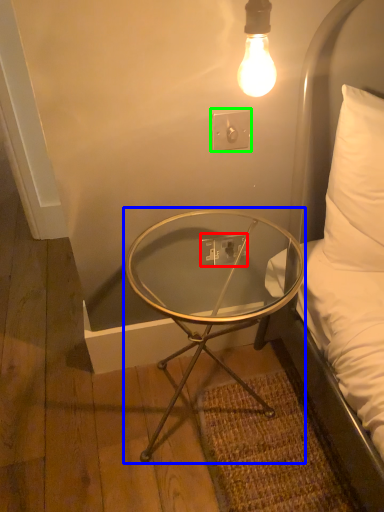
Question: Considering the real-world distances, which object is farthest from electric outlet (highlighted by a red box)? coffee table (highlighted by a blue box) or electric outlet (highlighted by a green box)?

Choices:
 (A) coffee table
 (B) electric outlet

Answer: (B)